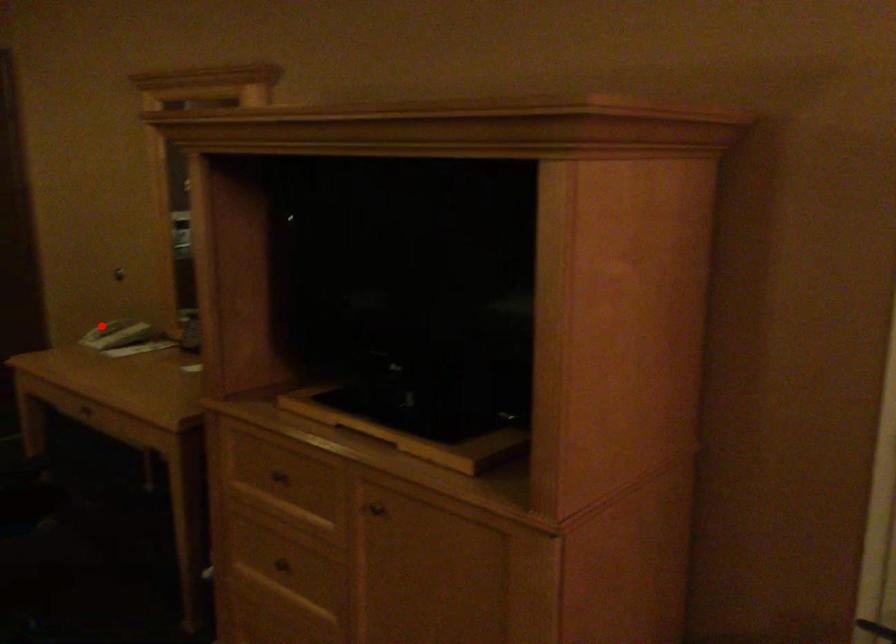
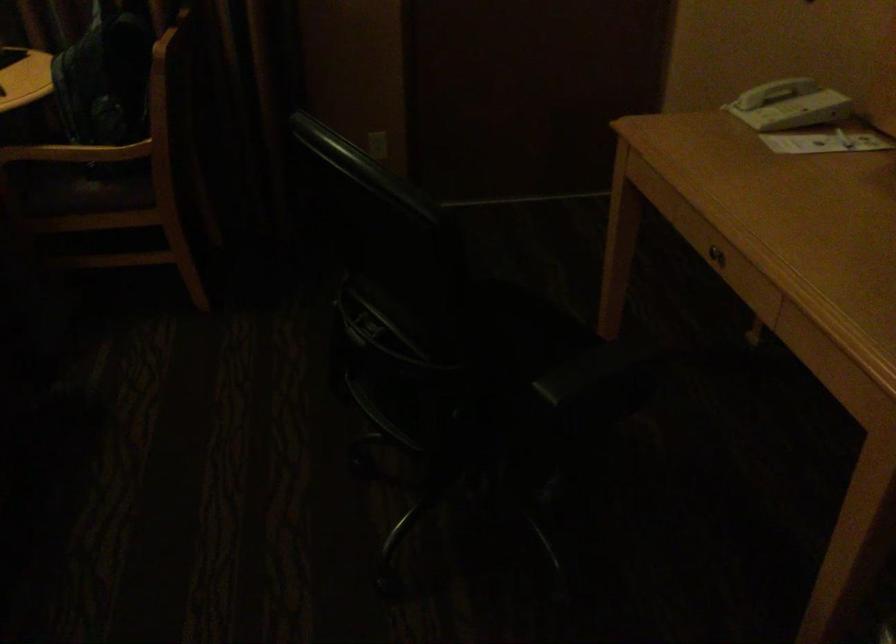
In the second image, find the point that corresponds to the highlighted location in the first image.

(768, 91)